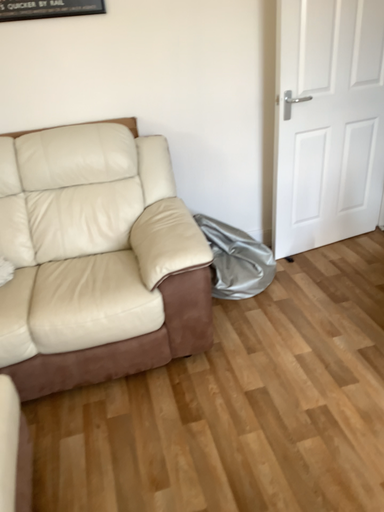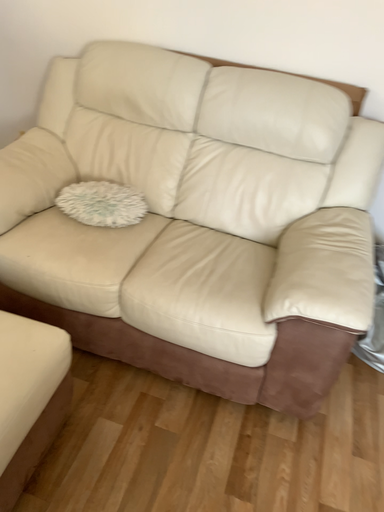
Question: Which way did the camera rotate in the video?

Choices:
 (A) rotated right
 (B) rotated left

Answer: (B)